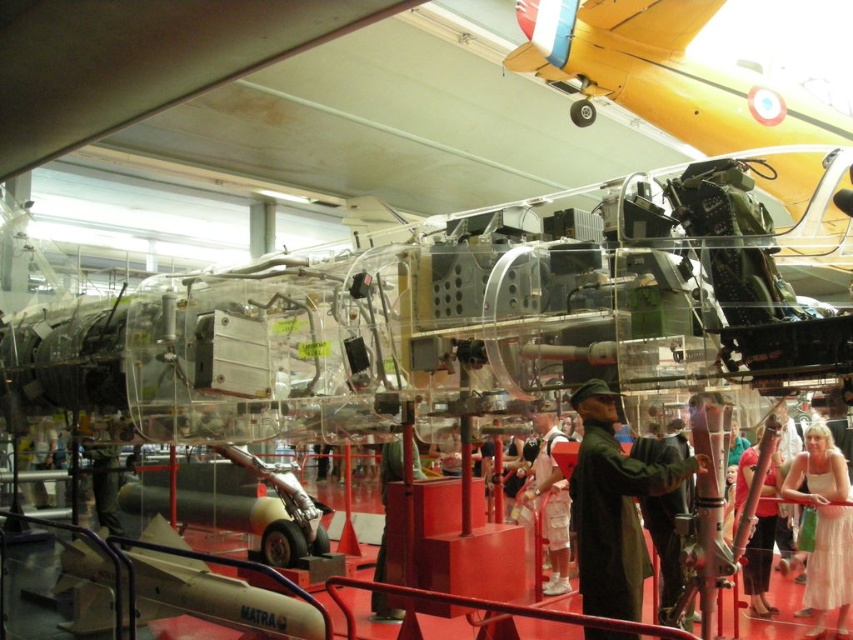
Question: Which object is farther from the camera taking this photo?

Choices:
 (A) white lace dress at center
 (B) green fabric jacket at center
 (C) metallic green cockpit at center
 (D) green matte uniform at center

Answer: (C)

Question: Does metallic green cockpit at center have a smaller size compared to green matte uniform at center?

Choices:
 (A) no
 (B) yes

Answer: (A)

Question: Considering the relative positions of green matte uniform at center and light brown wooden pole at lower right in the image provided, where is green matte uniform at center located with respect to light brown wooden pole at lower right?

Choices:
 (A) below
 (B) above

Answer: (B)

Question: Which point is farther from the camera taking this photo?

Choices:
 (A) (606, 458)
 (B) (379, 577)
 (C) (531, 64)
 (D) (757, 497)

Answer: (C)

Question: Is metallic green cockpit at center smaller than green fabric jacket at center?

Choices:
 (A) no
 (B) yes

Answer: (A)

Question: Which point is closer to the camera taking this photo?

Choices:
 (A) (793, 493)
 (B) (398, 465)

Answer: (A)